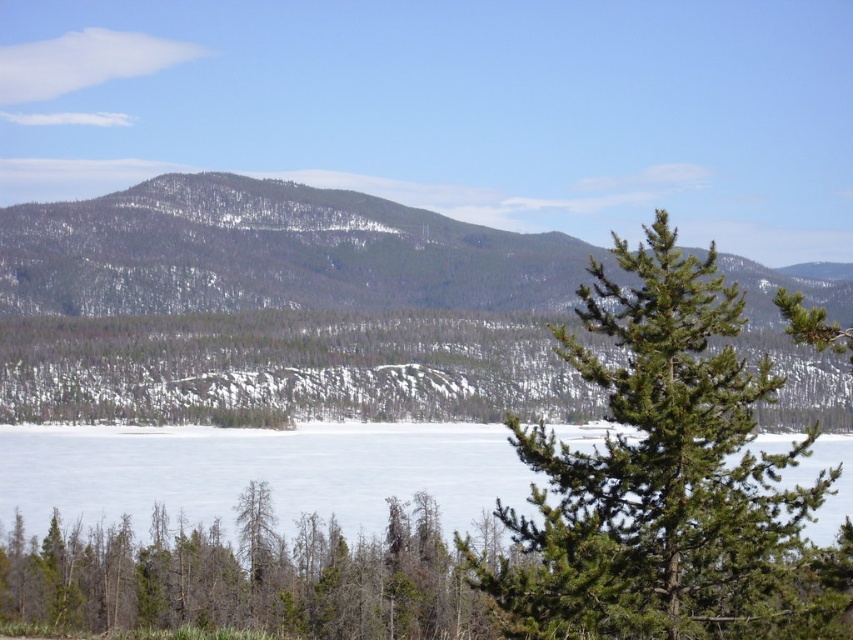
You are standing at the edge of the frozen lake and see two points marked on the image. Which point, point (171, 188) or point (1, 472), is closer to you?

Point (171, 188) is closer to you because it is further to the viewer than point (1, 472).